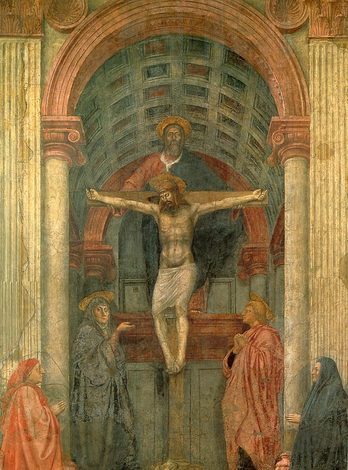
I want to click on support column, so click(x=300, y=297), click(x=56, y=305).